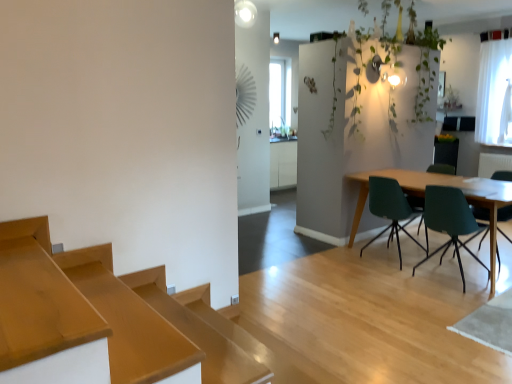
Question: Considering the relative positions of green matte chair at right, the fourth chair in the left-to-right sequence, and teal plastic chair at center right, which is the fourth chair from right to left, in the image provided, is green matte chair at right, the fourth chair in the left-to-right sequence, to the right of teal plastic chair at center right, which is the fourth chair from right to left, from the viewer's perspective?

Choices:
 (A) no
 (B) yes

Answer: (B)

Question: From a real-world perspective, does green matte chair at right, the fourth chair in the left-to-right sequence, sit lower than teal plastic chair at center right, the 1th chair positioned from the left?

Choices:
 (A) yes
 (B) no

Answer: (B)

Question: From the image's perspective, does green matte chair at right, the first chair in the right-to-left sequence, appear lower than teal plastic chair at center right, which is the fourth chair from right to left?

Choices:
 (A) no
 (B) yes

Answer: (B)

Question: From the image's perspective, is green matte chair at right, the first chair in the right-to-left sequence, over teal plastic chair at center right, the 1th chair positioned from the left?

Choices:
 (A) no
 (B) yes

Answer: (A)

Question: Is green matte chair at right, the fourth chair in the left-to-right sequence, closer to camera compared to teal plastic chair at center right, which is the fourth chair from right to left?

Choices:
 (A) no
 (B) yes

Answer: (B)

Question: Considering their positions, is teal plastic chair at center right, the 1th chair positioned from the left, located in front of or behind green matte chair at right, marked as the second chair in a right-to-left arrangement?

Choices:
 (A) behind
 (B) front

Answer: (B)

Question: From the image's perspective, is teal plastic chair at center right, which is the fourth chair from right to left, located above or below green matte chair at right, marked as the second chair in a right-to-left arrangement?

Choices:
 (A) below
 (B) above

Answer: (A)

Question: Considering the positions of point (398, 198) and point (453, 168), is point (398, 198) closer or farther from the camera than point (453, 168)?

Choices:
 (A) farther
 (B) closer

Answer: (B)

Question: Is teal plastic chair at center right, which is the fourth chair from right to left, wider or thinner than green matte chair at right, the 3th chair when ordered from left to right?

Choices:
 (A) thin
 (B) wide

Answer: (A)

Question: Based on their sizes in the image, would you say wooden table at right is bigger or smaller than matte green chair at right, marked as the 3th chair in a right-to-left arrangement?

Choices:
 (A) small
 (B) big

Answer: (B)

Question: From the image's perspective, is wooden table at right located above or below matte green chair at right, arranged as the second chair when viewed from the left?

Choices:
 (A) below
 (B) above

Answer: (B)

Question: Looking at their shapes, would you say wooden table at right is wider or thinner than matte green chair at right, arranged as the second chair when viewed from the left?

Choices:
 (A) wide
 (B) thin

Answer: (A)

Question: From a real-world perspective, relative to matte green chair at right, marked as the 3th chair in a right-to-left arrangement, is wooden table at right vertically above or below?

Choices:
 (A) above
 (B) below

Answer: (B)

Question: Considering their positions, is wooden table at right located in front of or behind green matte chair at right, the fourth chair in the left-to-right sequence?

Choices:
 (A) behind
 (B) front

Answer: (B)

Question: Considering the positions of wooden table at right and green matte chair at right, the fourth chair in the left-to-right sequence, in the image, is wooden table at right bigger or smaller than green matte chair at right, the fourth chair in the left-to-right sequence,?

Choices:
 (A) small
 (B) big

Answer: (B)